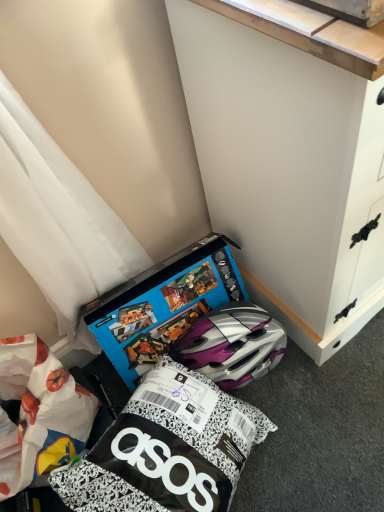
Question: From the image's perspective, is white painted wood cabinet at lower right located above or below blue cardboard box at lower center?

Choices:
 (A) below
 (B) above

Answer: (B)

Question: From a real-world perspective, is white painted wood cabinet at lower right physically located above or below blue cardboard box at lower center?

Choices:
 (A) above
 (B) below

Answer: (A)

Question: Choose the correct answer: Is white painted wood cabinet at lower right inside blue cardboard box at lower center or outside it?

Choices:
 (A) inside
 (B) outside

Answer: (B)

Question: Is blue cardboard box at lower center wider or thinner than white painted wood cabinet at lower right?

Choices:
 (A) wide
 (B) thin

Answer: (B)

Question: From a real-world perspective, is blue cardboard box at lower center positioned above or below white painted wood cabinet at lower right?

Choices:
 (A) above
 (B) below

Answer: (B)

Question: Based on their positions, is blue cardboard box at lower center located to the left or right of white painted wood cabinet at lower right?

Choices:
 (A) left
 (B) right

Answer: (A)

Question: Does point pos(96,323) appear closer or farther from the camera than point pos(289,202)?

Choices:
 (A) closer
 (B) farther

Answer: (B)